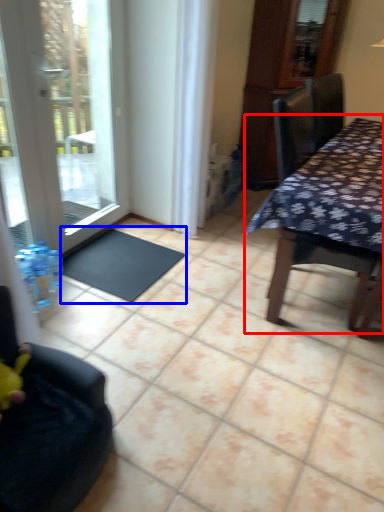
Question: Which point is further to the camera, table (highlighted by a red box) or doormat (highlighted by a blue box)?

Choices:
 (A) table
 (B) doormat

Answer: (B)